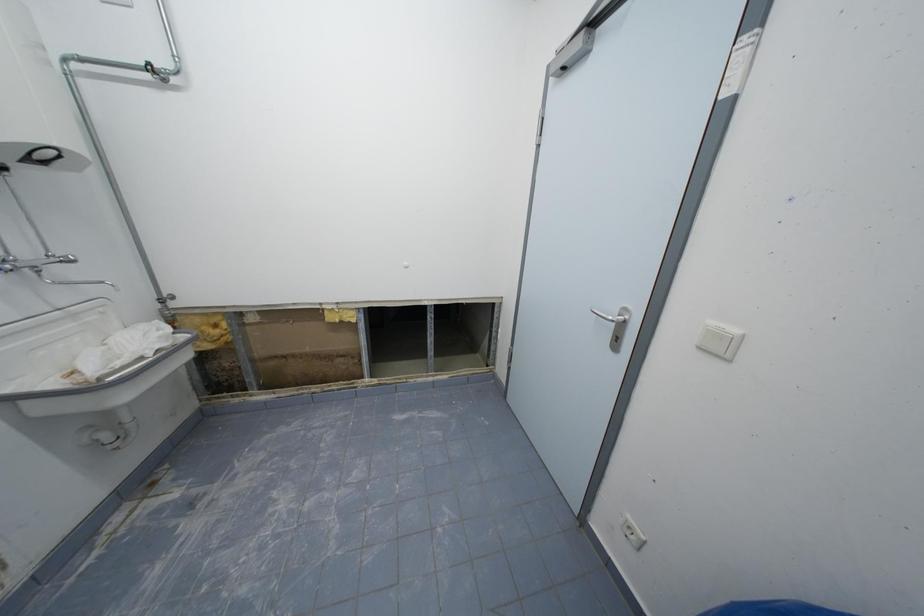
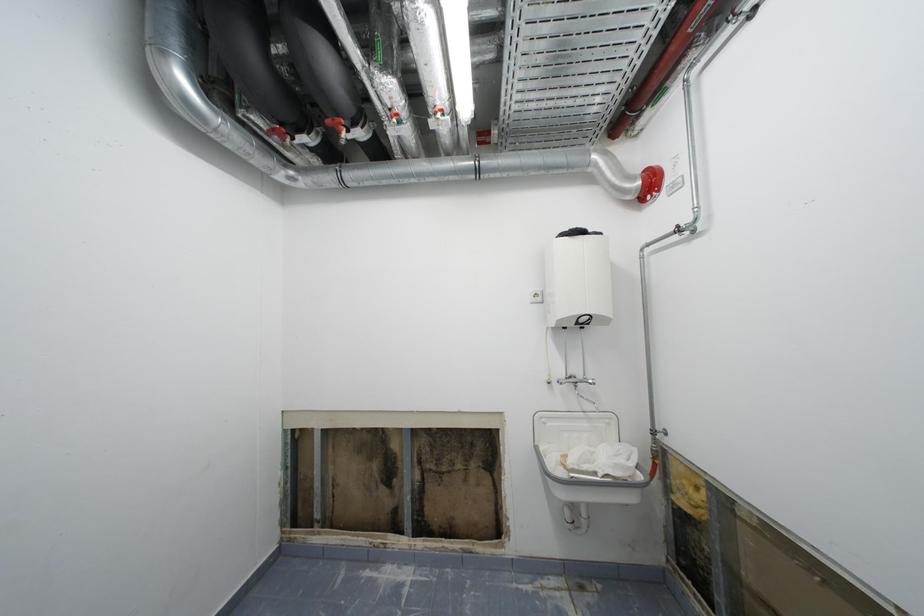
Question: The first image is from the beginning of the video and the second image is from the end. How did the camera likely rotate when shooting the video?

Choices:
 (A) Left
 (B) Right
 (C) Up
 (D) Down

Answer: (A)